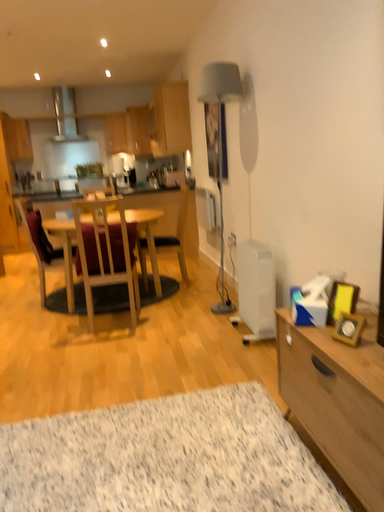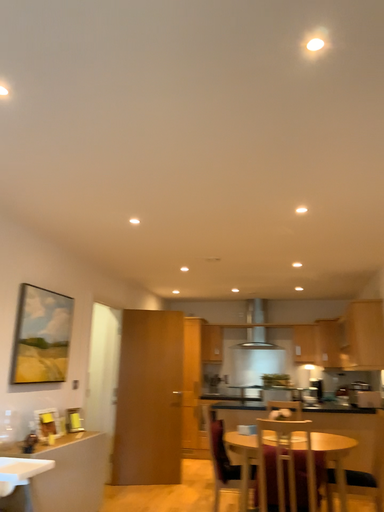
Question: Which way did the camera rotate in the video?

Choices:
 (A) rotated downward
 (B) rotated upward

Answer: (B)